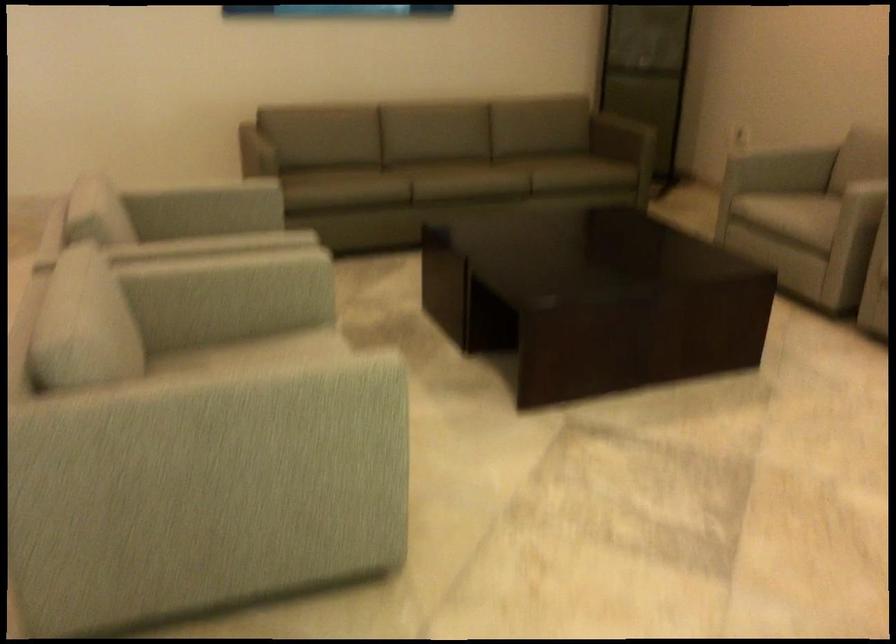
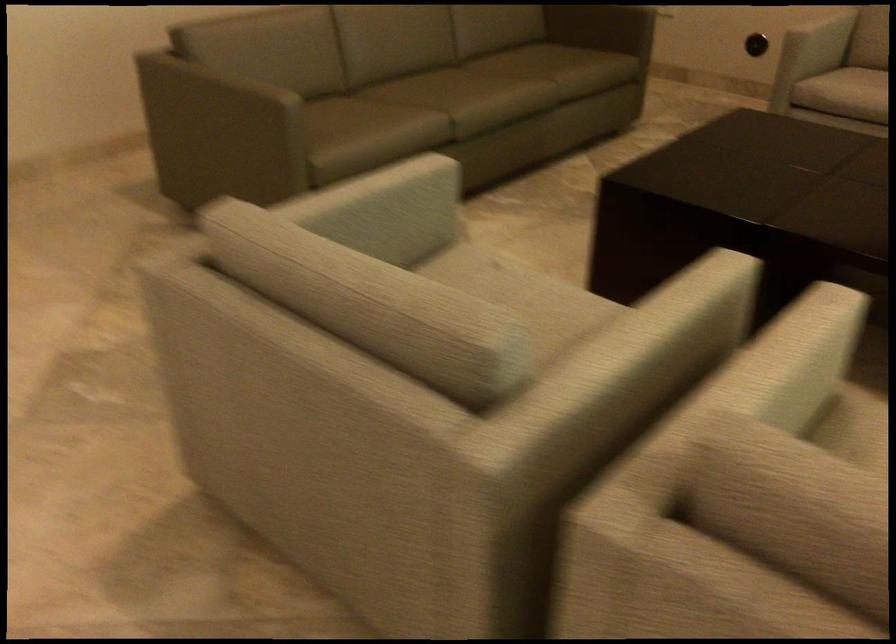
Where in the second image is the point corresponding to point 194,199 from the first image?

(380, 210)